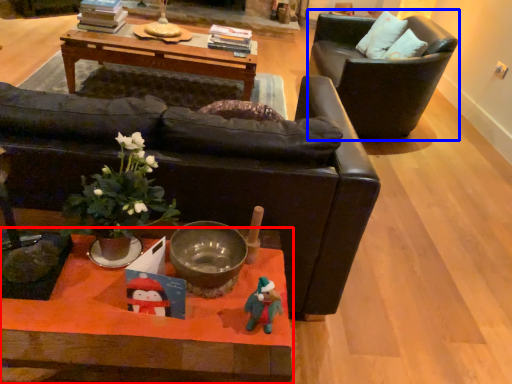
Question: Which object appears farthest to the camera in this image, coffee table (highlighted by a red box) or chair (highlighted by a blue box)?

Choices:
 (A) coffee table
 (B) chair

Answer: (B)